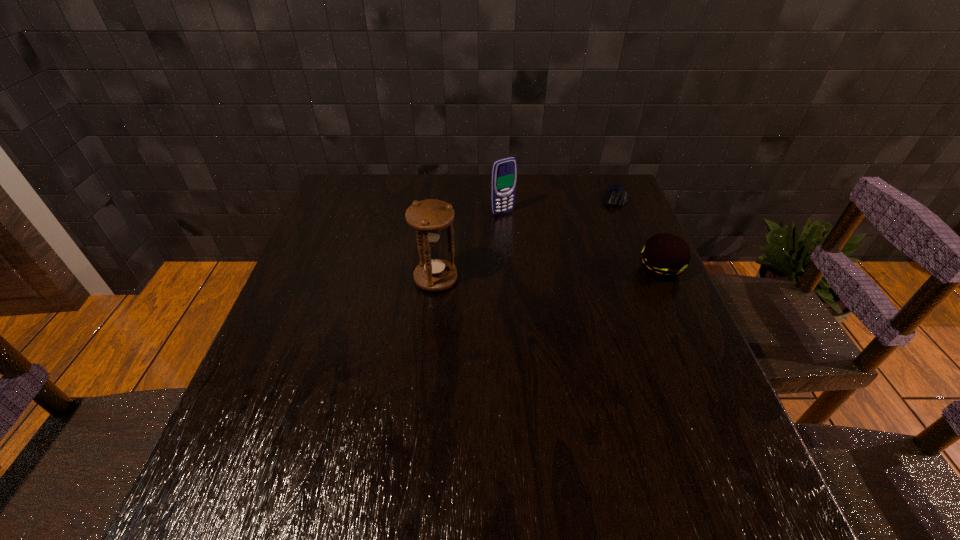
This screenshot has height=540, width=960. Identify the location of the tallest object. (429, 218).

Find the location of a particular element. hourglass is located at coordinates (429, 218).

Find the location of a particular element. The height and width of the screenshot is (540, 960). the third tallest object is located at coordinates (664, 257).

Find the location of a particular element. cellular telephone is located at coordinates (504, 171).

The height and width of the screenshot is (540, 960). In order to click on the third nearest object in this screenshot , I will do `click(504, 171)`.

Identify the location of computer mouse. The height and width of the screenshot is (540, 960). (615, 196).

Where is `the farthest object`? the farthest object is located at coordinates (615, 196).

Identify the location of vacant space located on the left of the leftmost object. This screenshot has height=540, width=960. (294, 279).

You are a GUI agent. You are given a task and a screenshot of the screen. Output one action in this format:
    pyautogui.click(x=<x>, y=<y>)
    Task: Click on the vacant area situated on the front of the patty
    
    Given the screenshot: What is the action you would take?
    pyautogui.click(x=705, y=370)

I want to click on free spot located on the front-facing side of the third nearest object, so click(x=586, y=301).